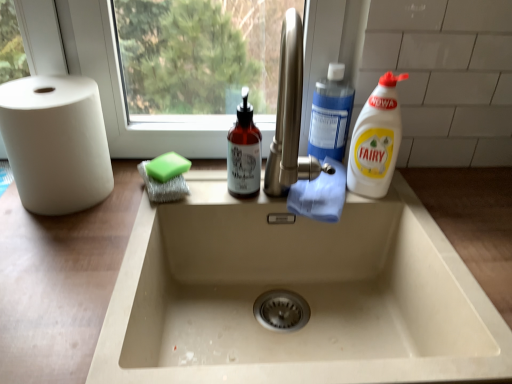
You are a GUI agent. You are given a task and a screenshot of the screen. Output one action in this format:
    pyautogui.click(x=<x>, y=<y>)
    Task: Click on the free area in between green sponge at upper left and translucent amber bottle at center, the first cleaning product in the left-to-right sequence
    
    Given the screenshot: What is the action you would take?
    click(207, 186)